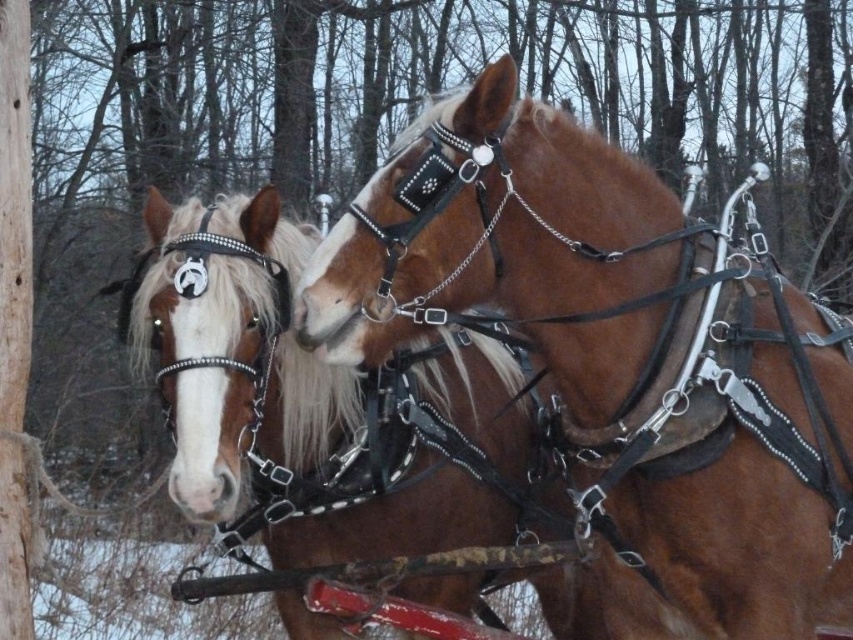
Question: Is brown leather harness at center above brown leather horse at left?

Choices:
 (A) no
 (B) yes

Answer: (B)

Question: Which point is farther from the camera taking this photo?

Choices:
 (A) (498, 394)
 (B) (851, 422)

Answer: (A)

Question: Which of the following is the closest to the observer?

Choices:
 (A) (671, 280)
 (B) (132, 310)

Answer: (A)

Question: Among these objects, which one is farthest from the camera?

Choices:
 (A) brown leather harness at center
 (B) brown leather horse at left

Answer: (B)

Question: Can you confirm if brown leather harness at center is positioned above brown leather horse at left?

Choices:
 (A) yes
 (B) no

Answer: (A)

Question: Is brown leather harness at center behind brown leather horse at left?

Choices:
 (A) yes
 (B) no

Answer: (B)